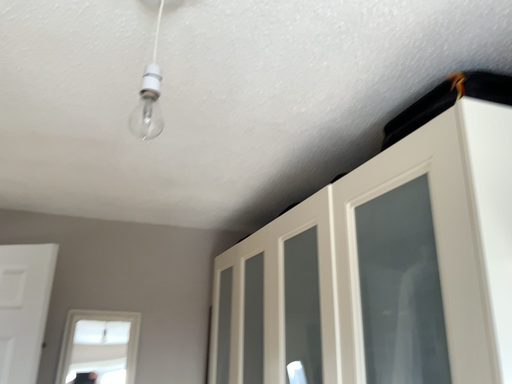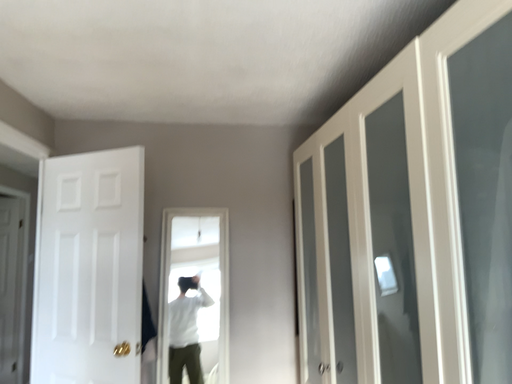
Question: Which way did the camera rotate in the video?

Choices:
 (A) rotated downward
 (B) rotated upward

Answer: (A)